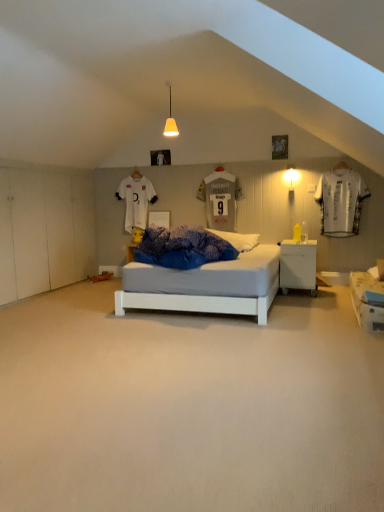
This screenshot has height=512, width=384. I want to click on blank space above white carpet at center (from a real-world perspective), so click(x=198, y=359).